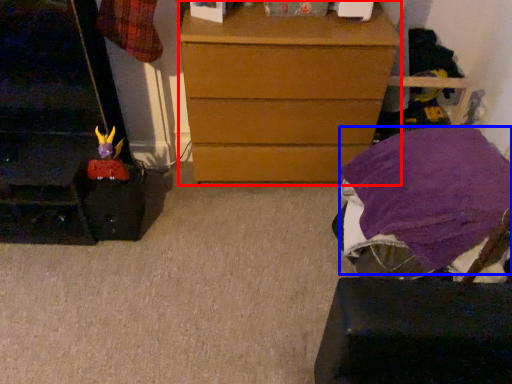
Question: Which of the following is the farthest to the observer, chest of drawers (highlighted by a red box) or blanket (highlighted by a blue box)?

Choices:
 (A) chest of drawers
 (B) blanket

Answer: (A)